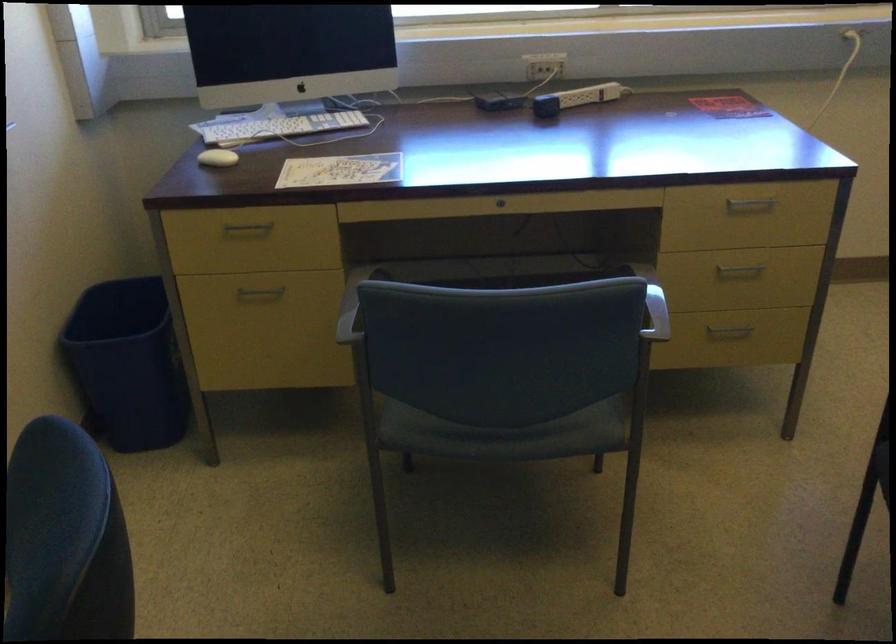
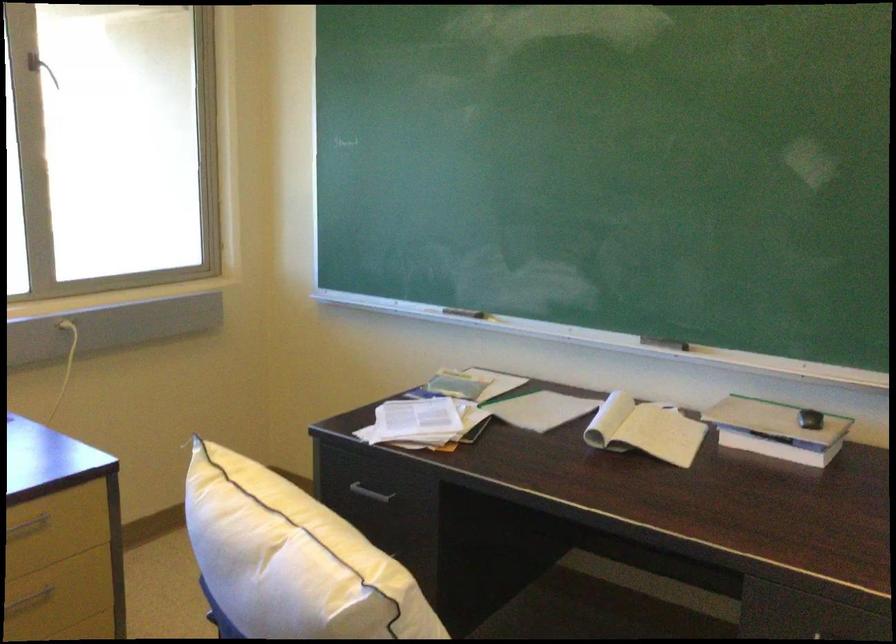
Question: The camera is either moving clockwise (left) or counter-clockwise (right) around the object. The first image is from the beginning of the video and the second image is from the end. Is the camera moving left or right when shooting the video?

Choices:
 (A) Left
 (B) Right

Answer: (A)